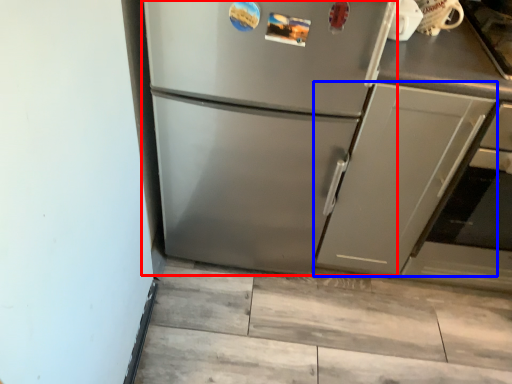
Question: Among these objects, which one is farthest to the camera, refrigerator (highlighted by a red box) or cabinetry (highlighted by a blue box)?

Choices:
 (A) refrigerator
 (B) cabinetry

Answer: (B)